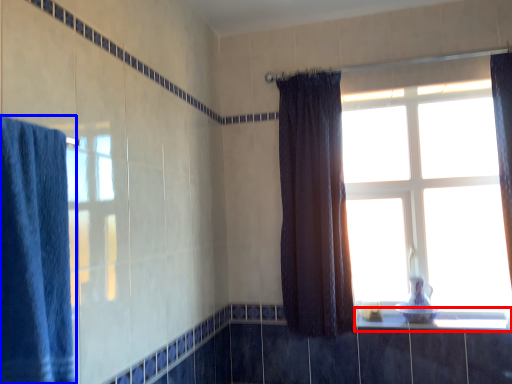
Question: Which of the following is the closest to the observer, window sill (highlighted by a red box) or curtain (highlighted by a blue box)?

Choices:
 (A) window sill
 (B) curtain

Answer: (B)